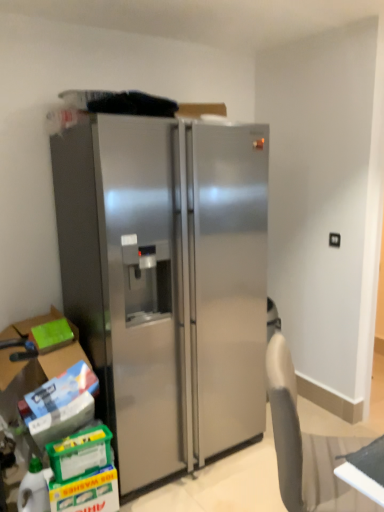
The image size is (384, 512). Describe the element at coordinates (167, 282) in the screenshot. I see `stainless steel refrigerator at center` at that location.

Image resolution: width=384 pixels, height=512 pixels. Identify the location of stainless steel refrigerator at center. [x=167, y=282].

The height and width of the screenshot is (512, 384). In order to click on stainless steel refrigerator at center in this screenshot , I will do `click(167, 282)`.

How much distance is there between translucent plastic bottle at lower left and green matte box at lower left?

They are 19.15 inches apart.

Where is `box on the left of translucent plastic bottle at lower left`? The image size is (384, 512). box on the left of translucent plastic bottle at lower left is located at coordinates (63, 357).

Between translucent plastic bottle at lower left and green matte box at lower left, which one has less height?

green matte box at lower left.

Between point (41, 508) and point (47, 374), which one is positioned behind?

The point (47, 374) is behind.

Does stainless steel refrigerator at center contain translucent plastic bottle at lower left?

That's incorrect, translucent plastic bottle at lower left is not inside stainless steel refrigerator at center.

Does point (239, 358) come behind point (34, 478)?

Yes, point (239, 358) is behind point (34, 478).

Is stainless steel refrigerator at center at the left side of translucent plastic bottle at lower left?

No, stainless steel refrigerator at center is not to the left of translucent plastic bottle at lower left.

Is stainless steel refrigerator at center oriented towards translucent plastic bottle at lower left?

No.

Looking at this image, from a real-world perspective, is green matte box at lower left below translucent plastic bottle at lower left?

Actually, green matte box at lower left is physically above translucent plastic bottle at lower left in the real world.

Is green matte box at lower left in contact with translucent plastic bottle at lower left?

No, green matte box at lower left is not in contact with translucent plastic bottle at lower left.

Measure the distance between green matte box at lower left and translucent plastic bottle at lower left.

green matte box at lower left and translucent plastic bottle at lower left are 48.64 centimeters apart.

Does green matte box at lower left appear on the left side of translucent plastic bottle at lower left?

Yes, green matte box at lower left is to the left of translucent plastic bottle at lower left.

At what (x,y) coordinates should I click in order to perform the action: click on bottle on the left of stainless steel refrigerator at center. Please return your answer as a coordinate pair (x, y). The image size is (384, 512). Looking at the image, I should click on (33, 489).

From the image's perspective, which one is positioned higher, translucent plastic bottle at lower left or stainless steel refrigerator at center?

stainless steel refrigerator at center is shown above in the image.

Are translucent plastic bottle at lower left and stainless steel refrigerator at center far apart?

That's not correct — translucent plastic bottle at lower left is a little close to stainless steel refrigerator at center.

Is point (26, 505) positioned in front of point (141, 346)?

Yes, it is in front of point (141, 346).

Considering the relative positions of stainless steel refrigerator at center and green matte box at lower left in the image provided, is stainless steel refrigerator at center behind green matte box at lower left?

No, stainless steel refrigerator at center is closer to the camera.

In order to click on box lying on the left of stainless steel refrigerator at center in this screenshot , I will do `click(63, 357)`.

Which of these two, stainless steel refrigerator at center or green matte box at lower left, is wider?

stainless steel refrigerator at center is wider.

Which of these two, stainless steel refrigerator at center or green matte box at lower left, stands taller?

stainless steel refrigerator at center.

Where is `refrigerator on the right of the green matte box at lower left`? This screenshot has width=384, height=512. refrigerator on the right of the green matte box at lower left is located at coordinates (167, 282).

Between green matte box at lower left and stainless steel refrigerator at center, which one is positioned in front?

stainless steel refrigerator at center is closer to the camera.

From a real-world perspective, between green matte box at lower left and stainless steel refrigerator at center, who is vertically higher?

stainless steel refrigerator at center, from a real-world perspective.

At what (x,y) coordinates should I click in order to perform the action: click on box above the translucent plastic bottle at lower left (from a real-world perspective). Please return your answer as a coordinate pair (x, y). The width and height of the screenshot is (384, 512). Looking at the image, I should click on (63, 357).

Image resolution: width=384 pixels, height=512 pixels. Find the location of `bottle located below the stainless steel refrigerator at center (from the image's perspective)`. bottle located below the stainless steel refrigerator at center (from the image's perspective) is located at coordinates (33, 489).

From the image, which object appears to be nearer to green matte box at lower left, stainless steel refrigerator at center or translucent plastic bottle at lower left?

Based on the image, translucent plastic bottle at lower left appears to be nearer to green matte box at lower left.

Based on their spatial positions, is translucent plastic bottle at lower left or stainless steel refrigerator at center further from green matte box at lower left?

stainless steel refrigerator at center.

From the picture: Looking at the image, which one is located closer to stainless steel refrigerator at center, translucent plastic bottle at lower left or green matte box at lower left?

Based on the image, green matte box at lower left appears to be nearer to stainless steel refrigerator at center.

Considering their positions, is green matte box at lower left positioned further to stainless steel refrigerator at center than translucent plastic bottle at lower left?

Among the two, translucent plastic bottle at lower left is located further to stainless steel refrigerator at center.

Based on their spatial positions, is green matte box at lower left or stainless steel refrigerator at center further from translucent plastic bottle at lower left?

stainless steel refrigerator at center is further to translucent plastic bottle at lower left.

From the image, which object appears to be nearer to translucent plastic bottle at lower left, stainless steel refrigerator at center or green matte box at lower left?

Based on the image, green matte box at lower left appears to be nearer to translucent plastic bottle at lower left.

Where is `box between stainless steel refrigerator at center and translucent plastic bottle at lower left vertically`? box between stainless steel refrigerator at center and translucent plastic bottle at lower left vertically is located at coordinates click(x=63, y=357).